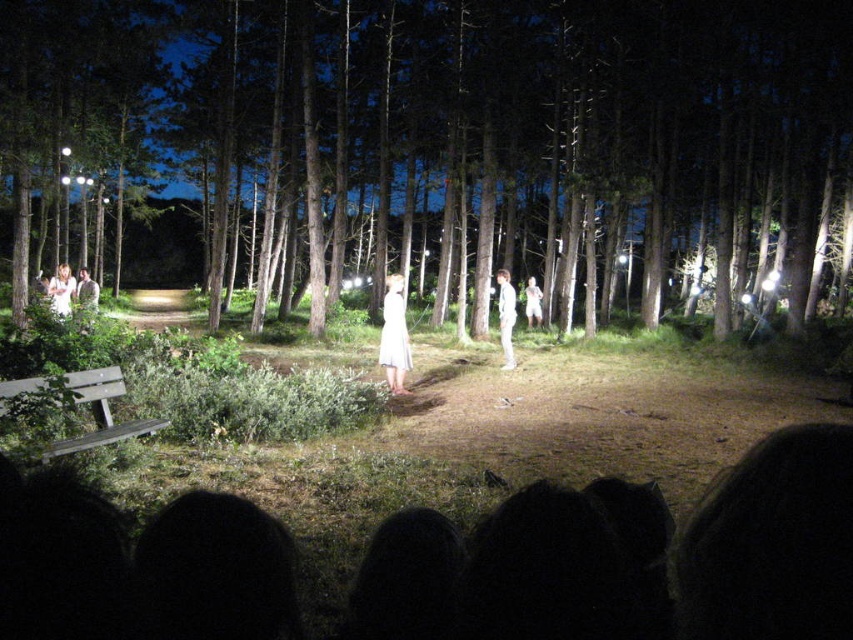
Based on the photo, you are a photographer at the event and want to capture a photo that includes both the white satin dress at center and the white cotton dress at left. Based on their positions, which dress should be placed on the right side of the photo frame to ensure both are visible?

The white satin dress at center should be placed on the right side of the photo frame because it is already positioned to the right of the white cotton dress at left, ensuring both are visible in the frame.

You are a photographer trying to capture the scene. You want to position yourself so that the wooden bench at lower left and the white cotton dress at center are both in the frame. Based on their positions, which object should you place closer to the left edge of your camera frame?

The wooden bench at lower left should be placed closer to the left edge of the camera frame because it is positioned to the left of the white cotton dress at center.